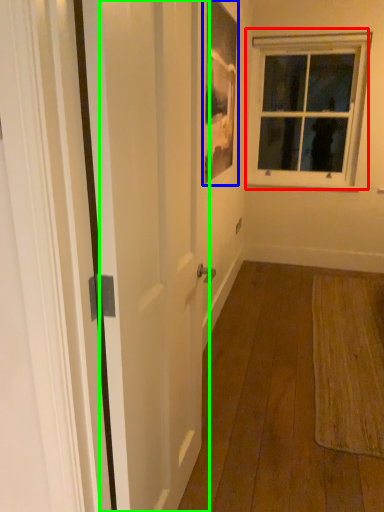
Question: Which is farther away from window (highlighted by a red box)? picture frame (highlighted by a blue box) or screen door (highlighted by a green box)?

Choices:
 (A) picture frame
 (B) screen door

Answer: (B)